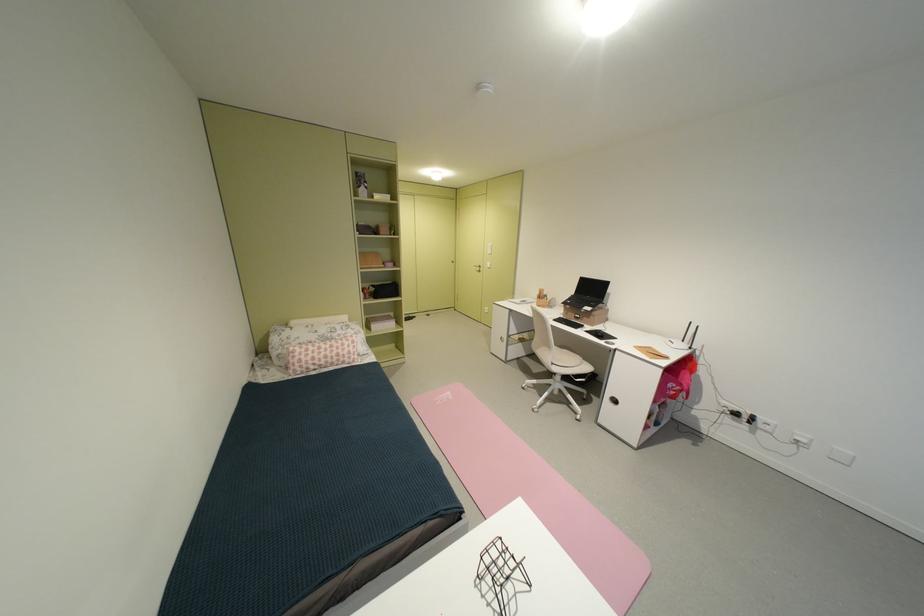
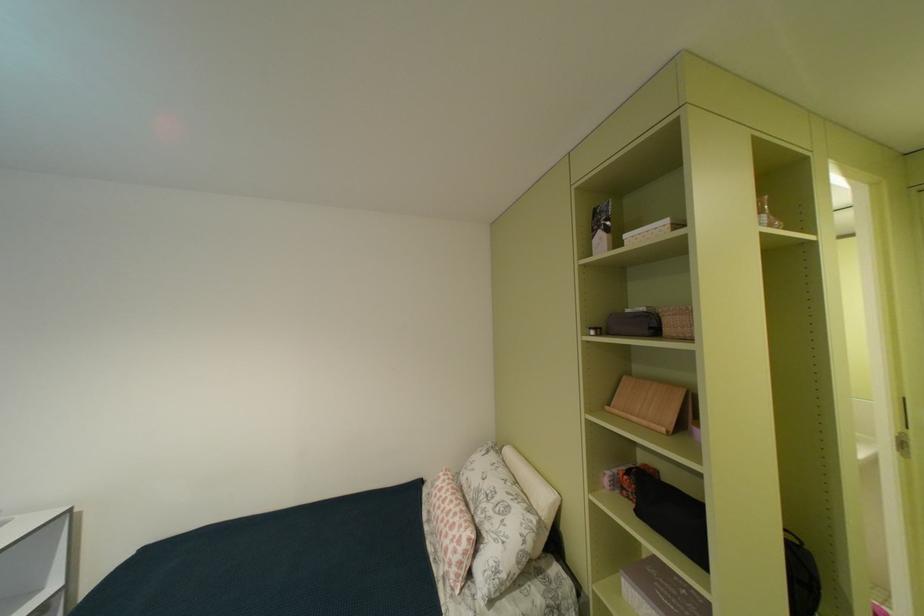
In the second image, find the point that corresponds to (x=326, y=338) in the first image.

(487, 487)